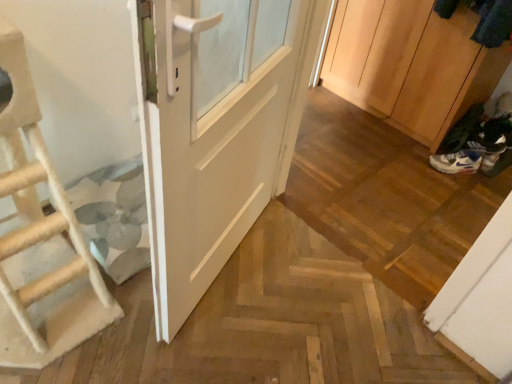
Where is `space that is in front of white leather shoe at lower right`? This screenshot has width=512, height=384. space that is in front of white leather shoe at lower right is located at coordinates (493, 182).